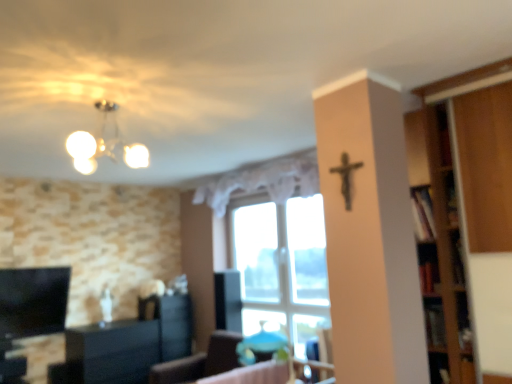
Question: From the image's perspective, is black glossy cabinet at lower left located above or below wooden bookshelf at lower right?

Choices:
 (A) above
 (B) below

Answer: (B)

Question: Is black glossy cabinet at lower left wider or thinner than wooden bookshelf at lower right?

Choices:
 (A) thin
 (B) wide

Answer: (B)

Question: Estimate the real-world distances between objects in this image. Which object is closer to the transparent glass window at center?

Choices:
 (A) wooden bookshelf at lower right
 (B) matte blue chair at center
 (C) black matte crucifix at upper center
 (D) white lace curtain at center
 (E) matte white chandelier at upper left

Answer: (D)

Question: Which object is positioned closest to the black glossy cabinet at lower left?

Choices:
 (A) matte blue chair at center
 (B) transparent glass window at center
 (C) black matte crucifix at upper center
 (D) wooden bookshelf at lower right
 (E) matte white chandelier at upper left

Answer: (A)